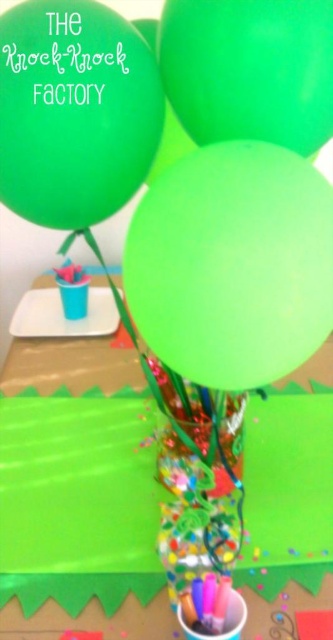
Question: In this image, where is green rubber balloon at center located relative to green matte balloon at upper center?

Choices:
 (A) left
 (B) right

Answer: (A)

Question: Can you confirm if matte green balloon at upper left is positioned to the right of green matte balloon at upper center?

Choices:
 (A) no
 (B) yes

Answer: (A)

Question: Which of the following is the closest to the observer?

Choices:
 (A) (287, 273)
 (B) (27, 216)
 (C) (158, 49)

Answer: (A)

Question: Estimate the real-world distances between objects in this image. Which object is closer to the matte green balloon at upper left?

Choices:
 (A) green rubber balloon at center
 (B) green matte balloon at upper center

Answer: (B)

Question: Can you confirm if green rubber balloon at center is thinner than green matte balloon at upper center?

Choices:
 (A) yes
 (B) no

Answer: (B)

Question: Which of the following is the farthest from the observer?

Choices:
 (A) (213, 332)
 (B) (239, 131)
 (C) (46, 51)

Answer: (B)